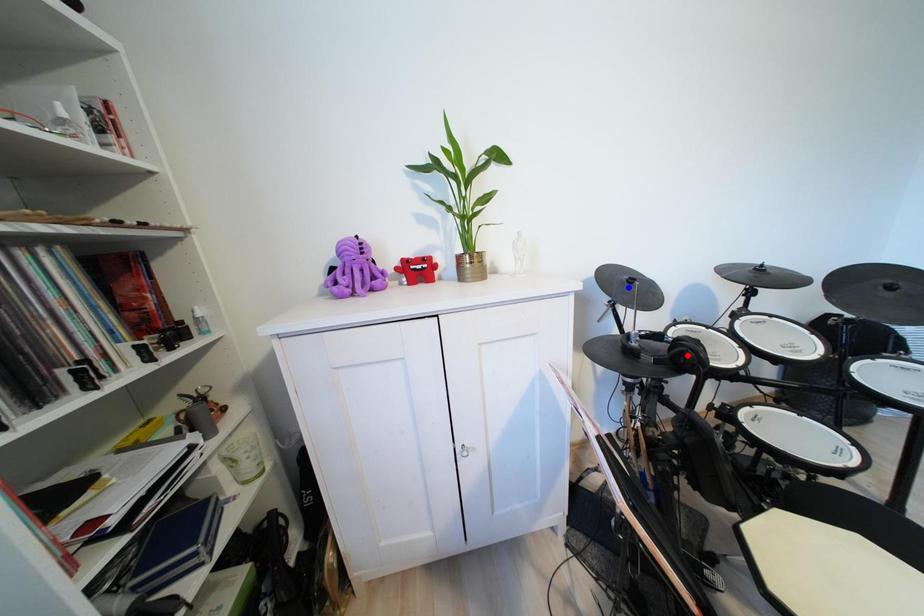
Question: Two points are marked on the image. Which point is closer to the camera?

Choices:
 (A) Blue point is closer.
 (B) Red point is closer.

Answer: (B)